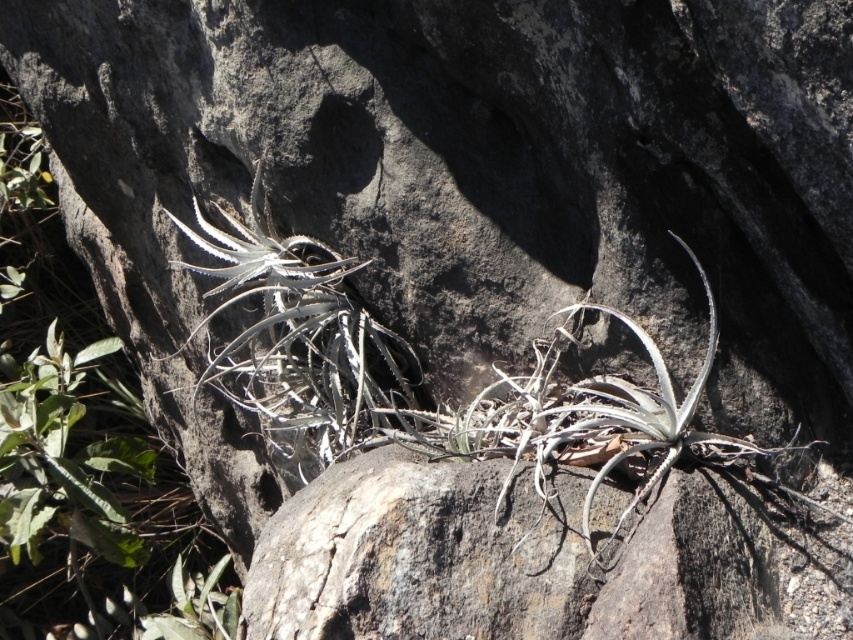
Question: Which of the following is the farthest from the observer?

Choices:
 (A) green leafy plant at left
 (B) gray/leathery airplant at center

Answer: (A)

Question: Which of the following is the closest to the observer?

Choices:
 (A) gray/leathery airplant at center
 (B) green leafy plant at left

Answer: (A)

Question: Does green leafy plant at left appear under gray/leathery airplant at center?

Choices:
 (A) yes
 (B) no

Answer: (A)

Question: Can you confirm if green leafy plant at left is positioned above gray/leathery airplant at center?

Choices:
 (A) yes
 (B) no

Answer: (B)

Question: Can you confirm if green leafy plant at left is thinner than gray/leathery airplant at center?

Choices:
 (A) yes
 (B) no

Answer: (B)